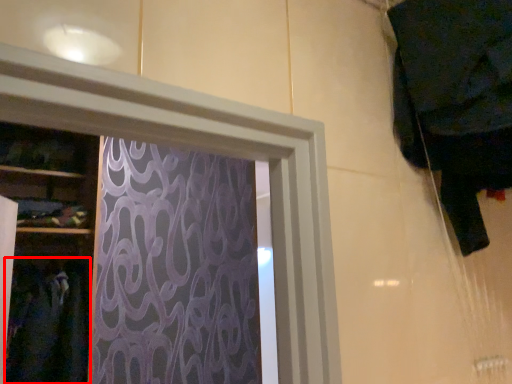
Question: From the image's perspective, what is the correct spatial relationship of clothing (annotated by the red box) in relation to clothing?

Choices:
 (A) above
 (B) below

Answer: (B)